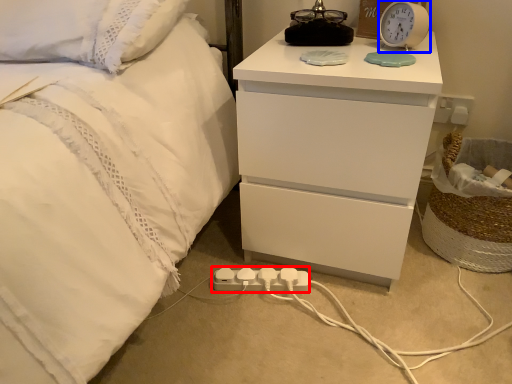
Question: Which object appears farthest to the camera in this image, extension cord (highlighted by a red box) or alarm clock (highlighted by a blue box)?

Choices:
 (A) extension cord
 (B) alarm clock

Answer: (A)